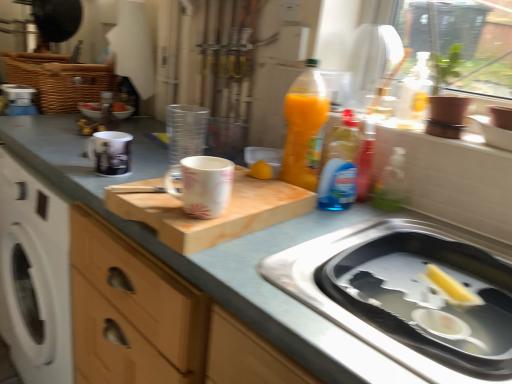
At what (x,y) coordinates should I click in order to perform the action: click on vacant area on the back side of matte white mug at upper left, which is the 2th mug from front to back. Please return your answer as a coordinate pair (x, y). The width and height of the screenshot is (512, 384). Looking at the image, I should click on (137, 150).